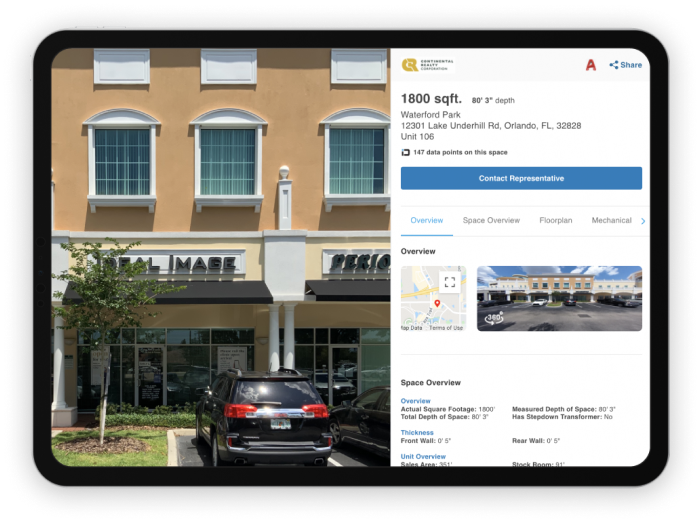
Identify the location of glass door. This screenshot has width=700, height=523. (148, 375), (351, 362).